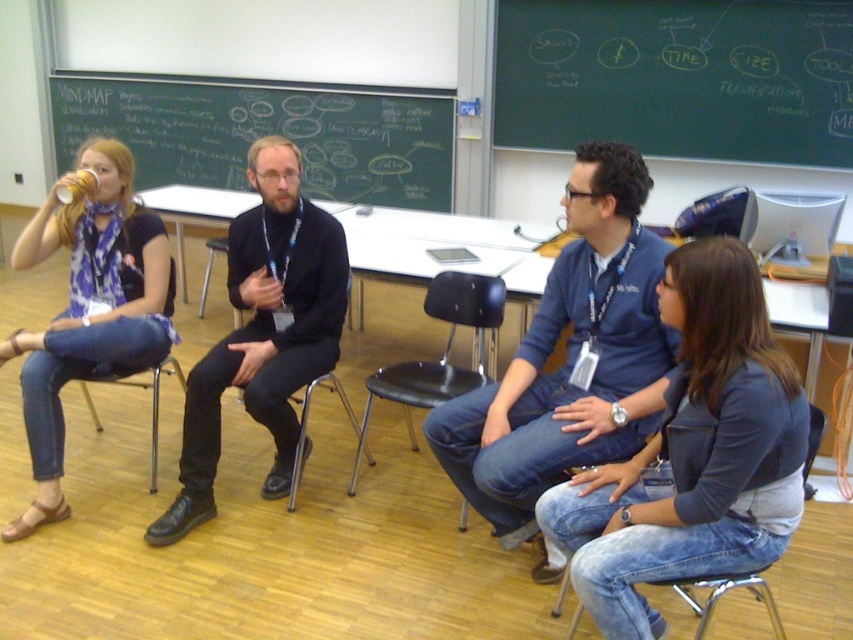
Question: Does black chalkboard at upper left have a larger size compared to black matte jacket at center?

Choices:
 (A) no
 (B) yes

Answer: (B)

Question: Does denim jeans at lower right have a larger size compared to black leather chair at center?

Choices:
 (A) no
 (B) yes

Answer: (A)

Question: Which is farther from the black leather chair at center?

Choices:
 (A) blue printed scarf at left
 (B) metallic silver chair at center

Answer: (A)

Question: Which point is closer to the camera?

Choices:
 (A) (604, 13)
 (B) (71, 280)
 (C) (308, 410)

Answer: (B)

Question: Can you confirm if blue denim jeans at center is positioned to the right of blue printed scarf at left?

Choices:
 (A) yes
 (B) no

Answer: (A)

Question: Estimate the real-world distances between objects in this image. Which object is closer to the blue printed scarf at left?

Choices:
 (A) denim jeans at lower right
 (B) metallic silver chair at left
 (C) black chalkboard at upper left

Answer: (B)